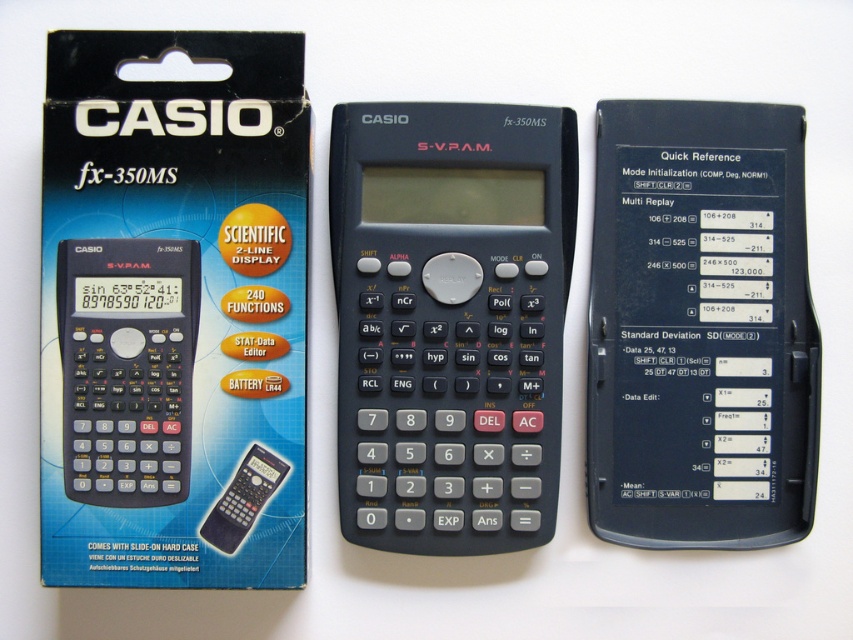
Question: In this image, where is matte black calculator at center located relative to black matte calculator at center?

Choices:
 (A) above
 (B) below

Answer: (A)

Question: Based on their relative distances, which object is farther from the black plastic calculator at center?

Choices:
 (A) black matte calculator at center
 (B) matte black calculator at center

Answer: (B)

Question: Which point is closer to the camera?

Choices:
 (A) black plastic calculator at center
 (B) matte black calculator at center

Answer: (B)

Question: Is matte black calculator at center to the right of black matte calculator at center from the viewer's perspective?

Choices:
 (A) yes
 (B) no

Answer: (B)

Question: Which point is farther to the camera?

Choices:
 (A) (239, 509)
 (B) (160, 314)
 (C) (384, 211)

Answer: (C)

Question: Can you confirm if black plastic calculator at center is wider than black matte calculator at center?

Choices:
 (A) no
 (B) yes

Answer: (B)